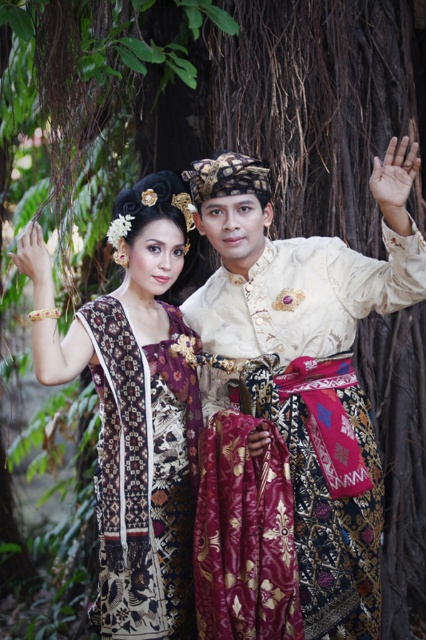
Image resolution: width=426 pixels, height=640 pixels. Find the location of `matte batik dress at center`. matte batik dress at center is located at coordinates (134, 412).

Locate an element on the screen. matte batik dress at center is located at coordinates (134, 412).